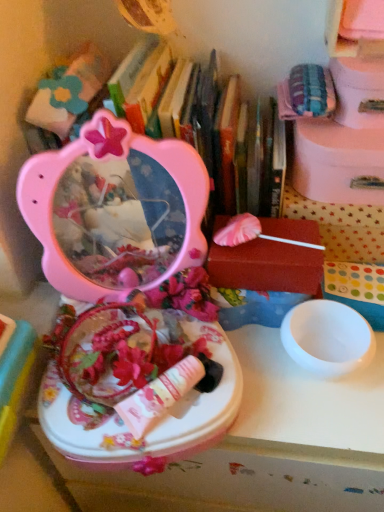
The height and width of the screenshot is (512, 384). In order to click on free space on the front side of white glossy bowl at right in this screenshot , I will do `click(323, 418)`.